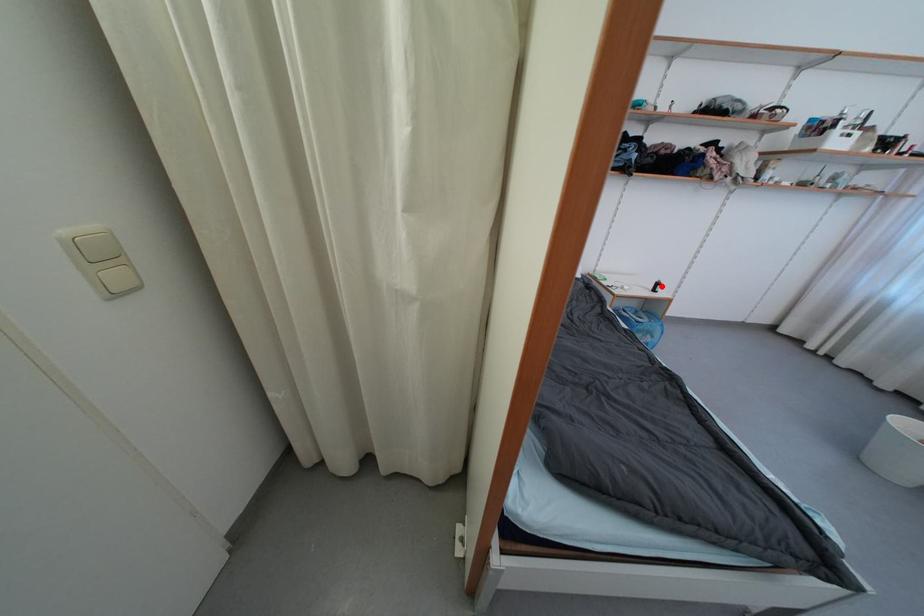
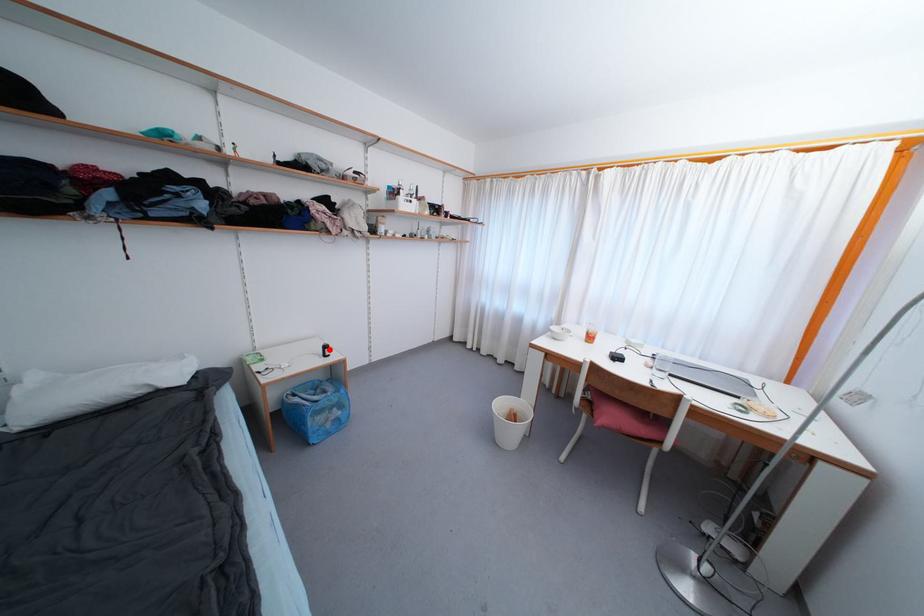
I am providing you with two images of the same scene from different viewpoints. A red point is marked on the first image and another point is marked on the second image. Is the red point in image1 aligned with the point shown in image2?

Yes